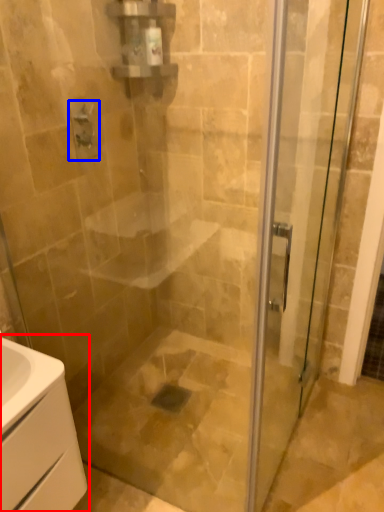
Question: Which point is closer to the camera, bathroom cabinet (highlighted by a red box) or shower (highlighted by a blue box)?

Choices:
 (A) bathroom cabinet
 (B) shower

Answer: (A)